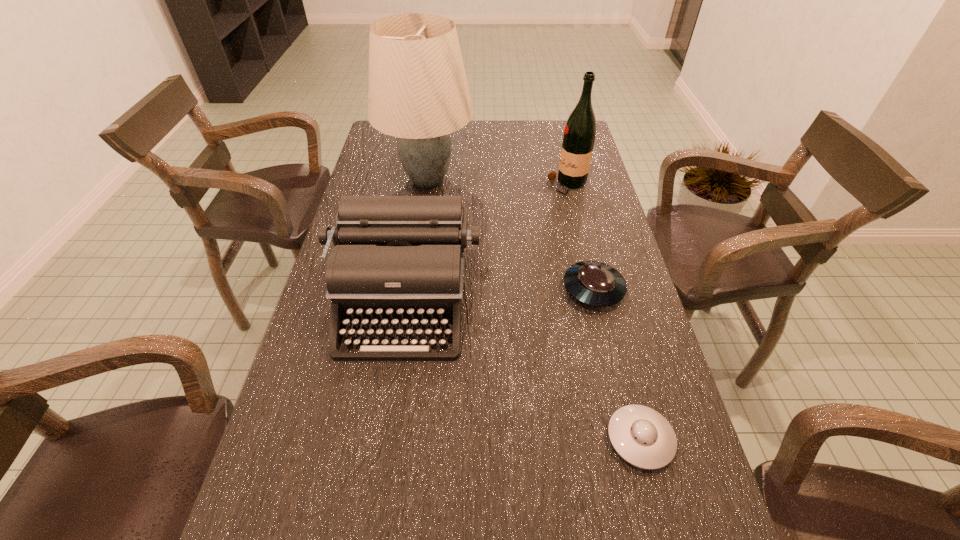
This screenshot has width=960, height=540. Find the location of `free space that is in between the typewriter and the shortest object`. free space that is in between the typewriter and the shortest object is located at coordinates (522, 371).

Find the location of `vacant space that is in between the third tallest object and the fourth shortest object`. vacant space that is in between the third tallest object and the fourth shortest object is located at coordinates (486, 244).

I want to click on blank region between the third tallest object and the fourth shortest object, so click(x=486, y=244).

Find the location of `vacant space that is in between the lampshade and the nearest object`. vacant space that is in between the lampshade and the nearest object is located at coordinates (534, 309).

This screenshot has height=540, width=960. What are the coordinates of `unoccupied position between the tallest object and the farther saucer` in the screenshot? It's located at (511, 234).

Where is `empty location between the taller saucer and the second tallest object`? This screenshot has height=540, width=960. empty location between the taller saucer and the second tallest object is located at coordinates (581, 237).

I want to click on free space between the nearest object and the third shortest object, so click(x=522, y=371).

The height and width of the screenshot is (540, 960). Find the location of `object identified as the second closest to the tallest object`. object identified as the second closest to the tallest object is located at coordinates (579, 135).

Image resolution: width=960 pixels, height=540 pixels. I want to click on object that is the fourth closest to the typewriter, so click(x=579, y=135).

Identify the location of vacant space that satisfies the following two spatial constraints: 1. on the typing side of the third tallest object; 2. on the right side of the nearer saucer. (382, 438).